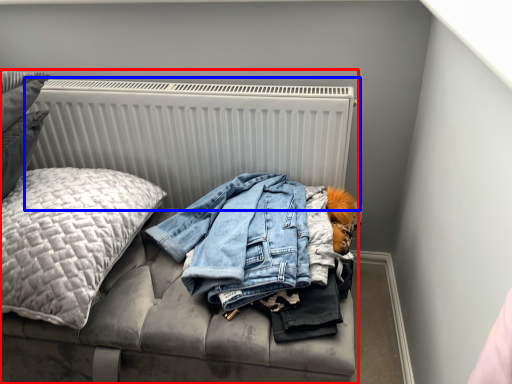
Question: Which point is further to the camera, furniture (highlighted by a red box) or radiator (highlighted by a blue box)?

Choices:
 (A) furniture
 (B) radiator

Answer: (B)